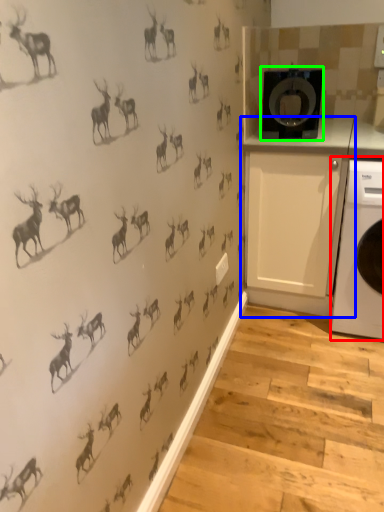
Question: Considering the real-world distances, which object is farthest from home appliance (highlighted by a red box)? cabinetry (highlighted by a blue box) or washing machine (highlighted by a green box)?

Choices:
 (A) cabinetry
 (B) washing machine

Answer: (B)